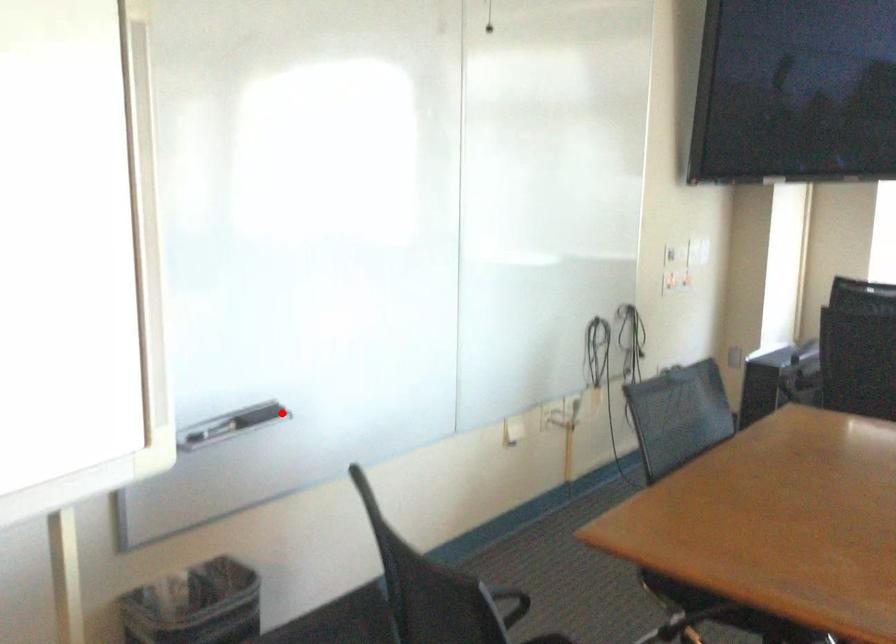
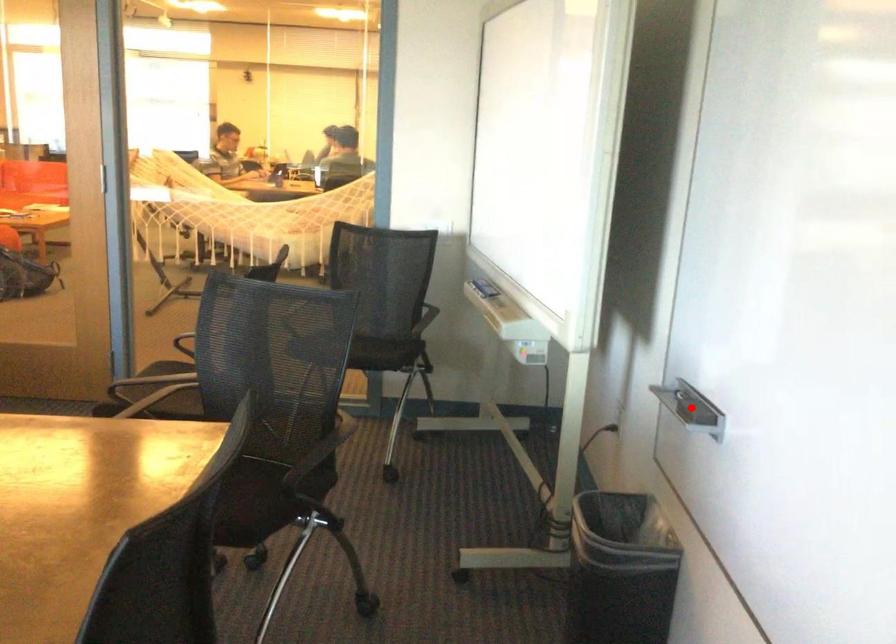
I am providing you with two images of the same scene from different viewpoints. A red point is marked on the first image and another point is marked on the second image. Is the marked point in image1 the same physical position as the marked point in image2?

Yes